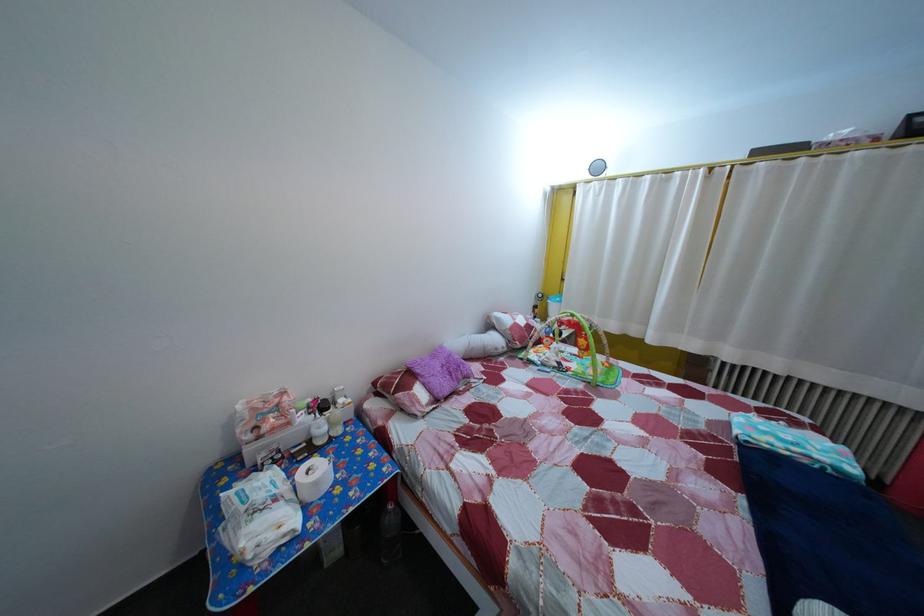
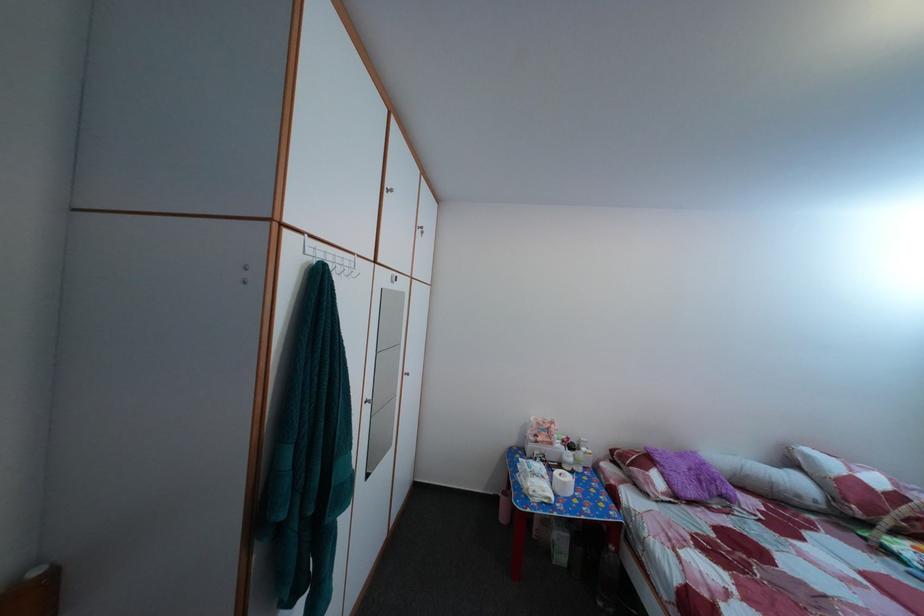
Question: How did the camera likely rotate?

Choices:
 (A) Left
 (B) Right
 (C) Up
 (D) Down

Answer: (A)